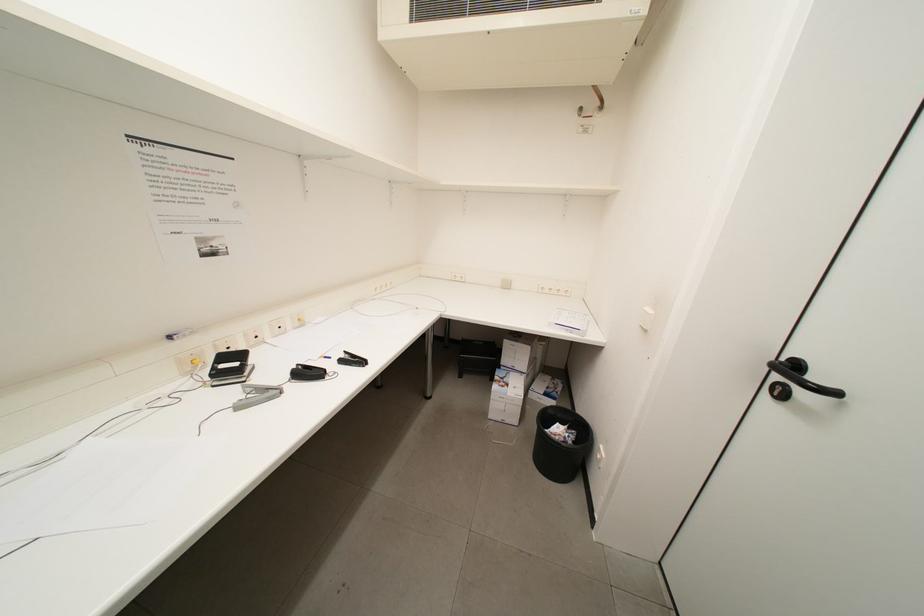
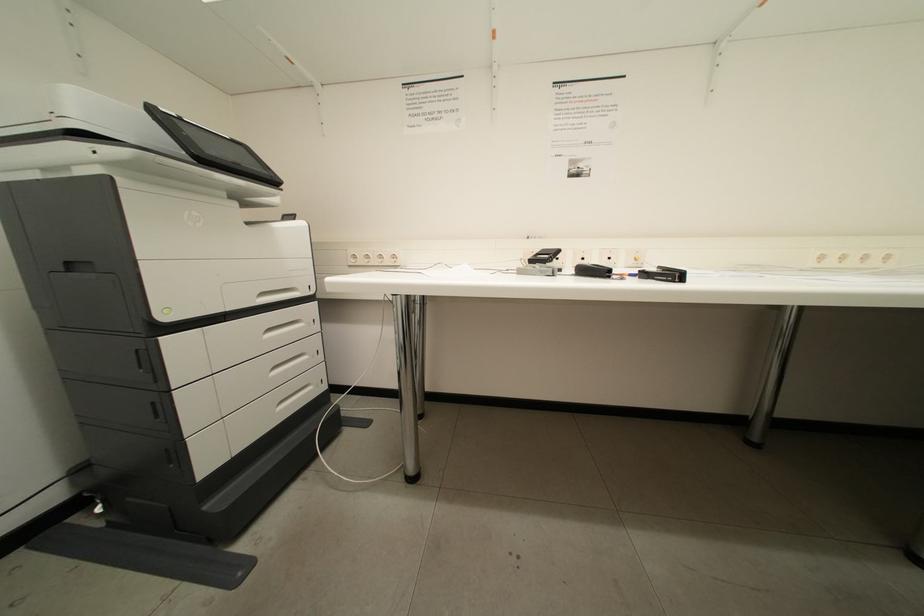
Question: How did the camera likely rotate?

Choices:
 (A) Left
 (B) Right
 (C) Up
 (D) Down

Answer: (A)